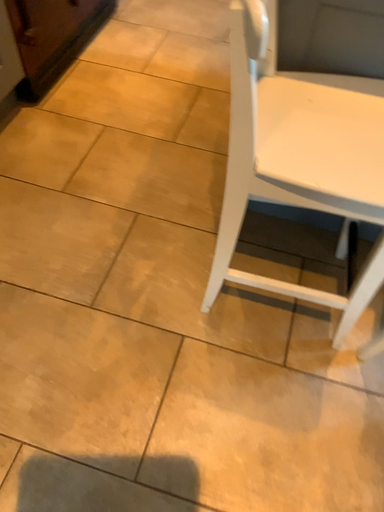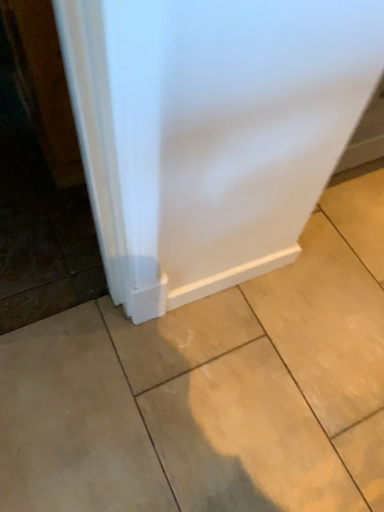
Question: Which way did the camera rotate in the video?

Choices:
 (A) rotated upward
 (B) rotated downward

Answer: (A)